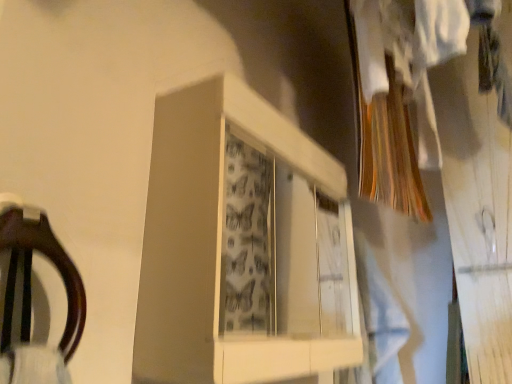
Question: Does white glossy cabinet at center have a lesser width compared to light blue fabric at center?

Choices:
 (A) no
 (B) yes

Answer: (B)

Question: Is white glossy cabinet at center directly adjacent to light blue fabric at center?

Choices:
 (A) yes
 (B) no

Answer: (B)

Question: From a real-world perspective, does white glossy cabinet at center sit lower than light blue fabric at center?

Choices:
 (A) no
 (B) yes

Answer: (A)

Question: Is white glossy cabinet at center behind light blue fabric at center?

Choices:
 (A) no
 (B) yes

Answer: (A)

Question: From the image's perspective, is white glossy cabinet at center located beneath light blue fabric at center?

Choices:
 (A) no
 (B) yes

Answer: (A)

Question: Is white glossy cabinet at center at the left side of light blue fabric at center?

Choices:
 (A) yes
 (B) no

Answer: (A)

Question: From a real-world perspective, is light blue fabric at center located higher than white glossy cabinet at center?

Choices:
 (A) no
 (B) yes

Answer: (A)

Question: Is the depth of light blue fabric at center less than that of white glossy cabinet at center?

Choices:
 (A) yes
 (B) no

Answer: (B)

Question: Considering the relative sizes of light blue fabric at center and white glossy cabinet at center in the image provided, is light blue fabric at center shorter than white glossy cabinet at center?

Choices:
 (A) no
 (B) yes

Answer: (A)

Question: From the image's perspective, is light blue fabric at center below white glossy cabinet at center?

Choices:
 (A) yes
 (B) no

Answer: (A)

Question: From the image's perspective, would you say light blue fabric at center is positioned over white glossy cabinet at center?

Choices:
 (A) no
 (B) yes

Answer: (A)

Question: Is light blue fabric at center aimed at white glossy cabinet at center?

Choices:
 (A) no
 (B) yes

Answer: (A)

Question: From the image's perspective, relative to white glossy cabinet at center, is light blue fabric at center above or below?

Choices:
 (A) above
 (B) below

Answer: (B)